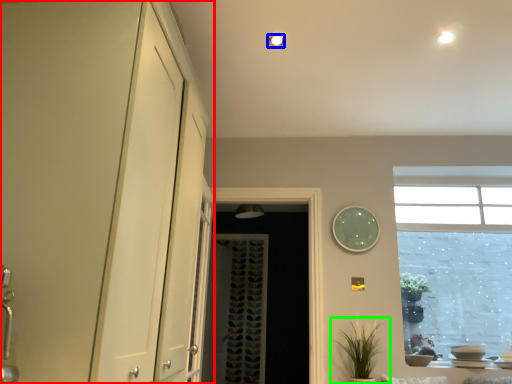
Question: Which is nearer to the dresser (highlighted by a red box)? lighting (highlighted by a blue box) or houseplant (highlighted by a green box).

Choices:
 (A) lighting
 (B) houseplant

Answer: (A)